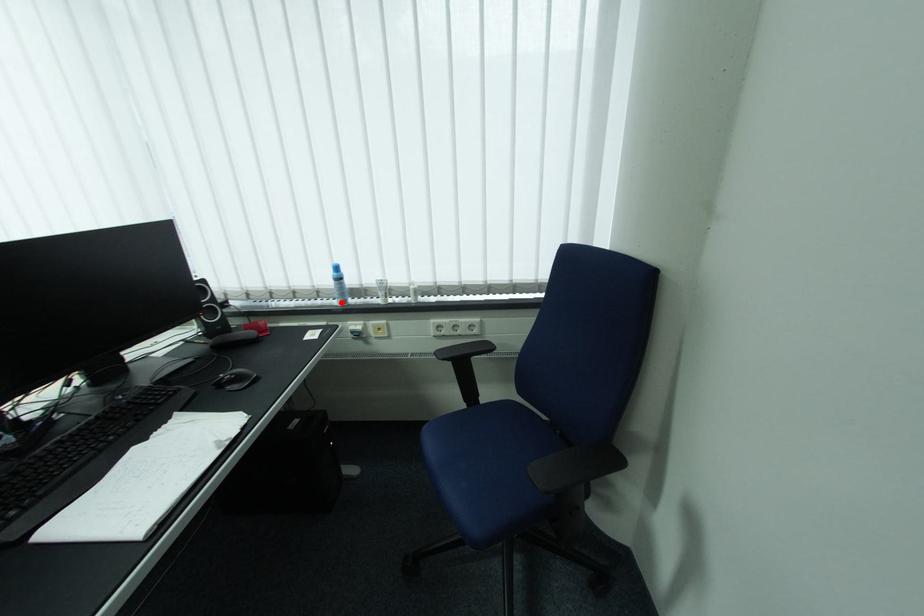
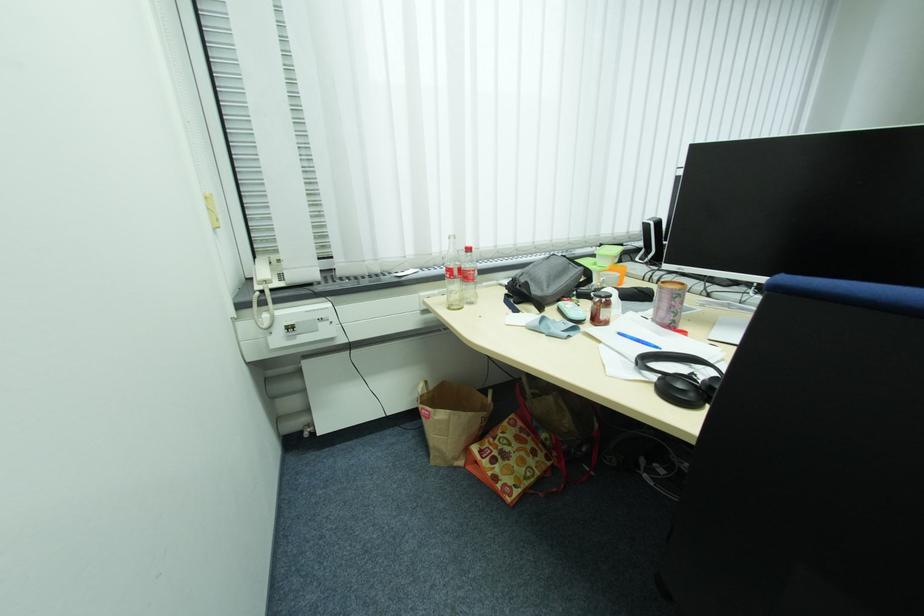
Question: I am providing you with two images of the same scene from different viewpoints. A red point is marked on the first image. Is the red point's position out of view in image 2?

Choices:
 (A) Yes
 (B) No

Answer: (A)